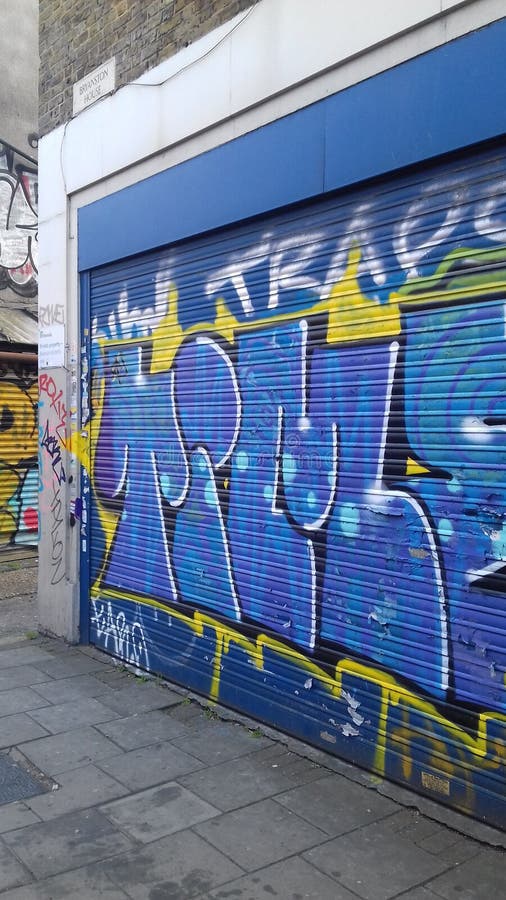
This screenshot has width=506, height=900. Identify the location of cable running along the top of the security grille. (63, 177).